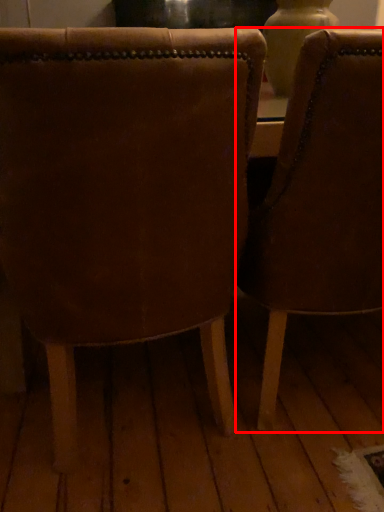
Question: From the image, what is the correct spatial relationship of chair (annotated by the red box) in relation to chair?

Choices:
 (A) right
 (B) left

Answer: (A)